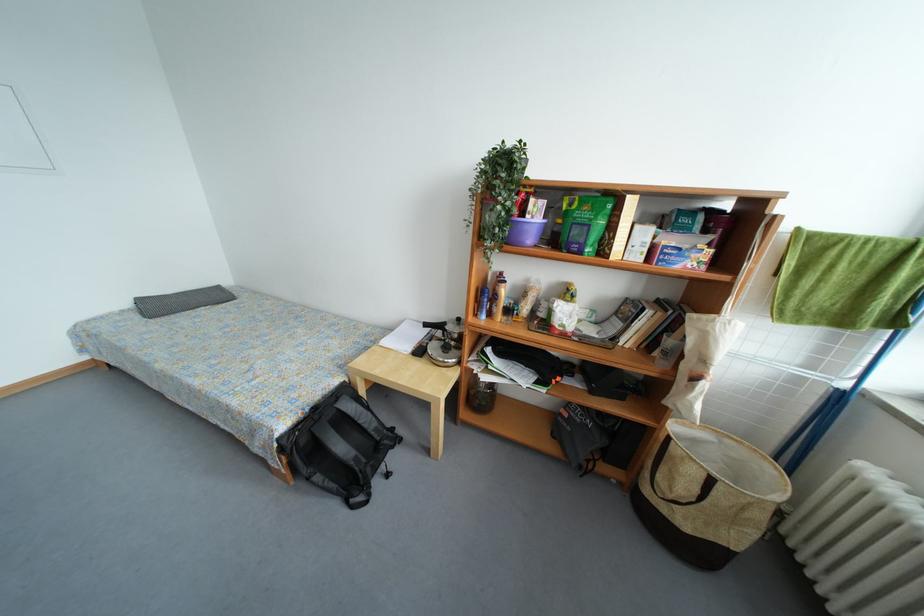
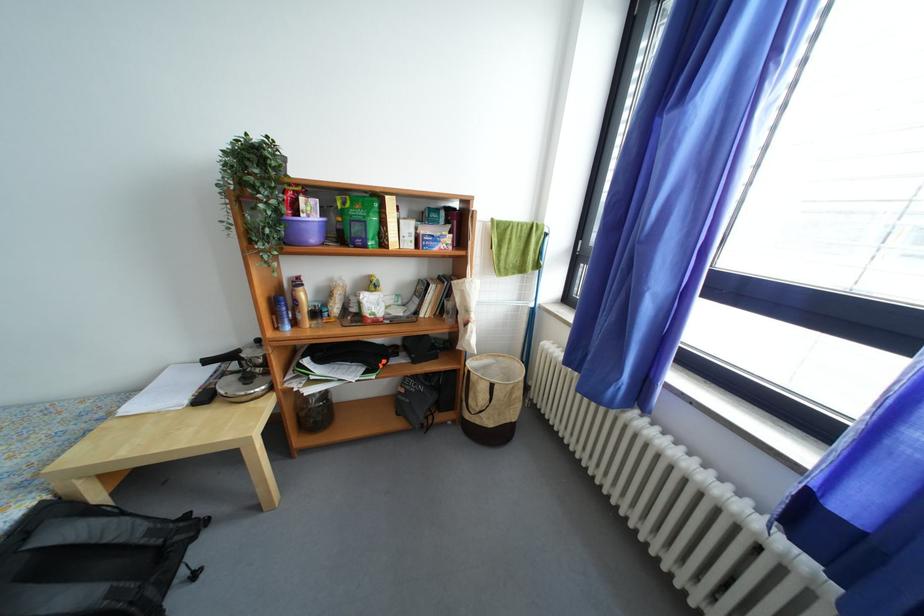
Where in the second image is the point corresponding to (446,331) from the first image?

(238, 361)